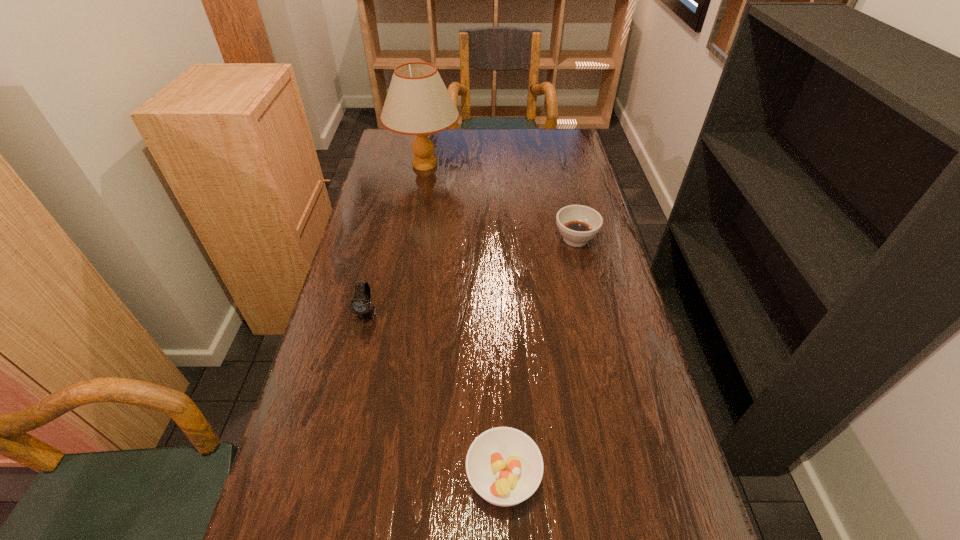
At what (x,y) coordinates should I click in order to perform the action: click on free location located on the back of the second farthest object. Please return your answer as a coordinate pair (x, y). Image resolution: width=960 pixels, height=540 pixels. Looking at the image, I should click on (564, 187).

Find the location of a particular element. The width and height of the screenshot is (960, 540). vacant position located 0.090m on the right of the shorter soup bowl is located at coordinates click(588, 478).

You are a GUI agent. You are given a task and a screenshot of the screen. Output one action in this format:
    pyautogui.click(x=<x>, y=<y>)
    Task: Click on the object that is at the far edge
    The height and width of the screenshot is (540, 960).
    Given the screenshot: What is the action you would take?
    pyautogui.click(x=418, y=103)

Locate an element on the screen. The height and width of the screenshot is (540, 960). lampshade positioned at the left edge is located at coordinates point(418,103).

This screenshot has width=960, height=540. In order to click on watch located at the left edge in this screenshot , I will do 360,304.

Image resolution: width=960 pixels, height=540 pixels. Identify the location of object that is positioned at the right edge. (578, 224).

Where is `object located at the far left corner`? The width and height of the screenshot is (960, 540). object located at the far left corner is located at coordinates (418, 103).

Find the location of a particular element. vacant space at the far edge is located at coordinates (529, 139).

I want to click on free space at the left edge of the desktop, so click(x=357, y=230).

This screenshot has width=960, height=540. Identify the location of vacant space at the right edge of the desktop. (587, 262).